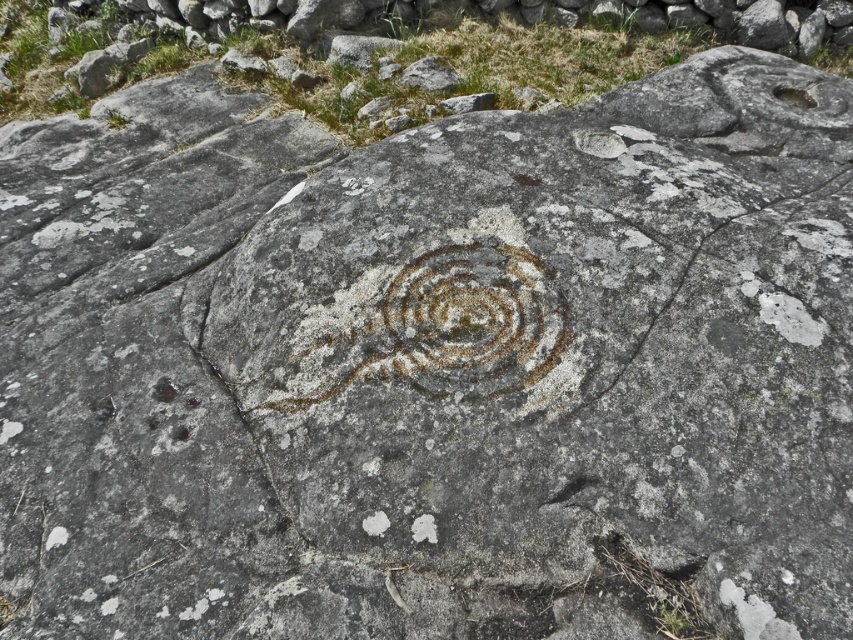
Can you confirm if gray rough crack at center is positioned to the right of rusty stone swirl at center?

Indeed, gray rough crack at center is positioned on the right side of rusty stone swirl at center.

Can you confirm if gray rough crack at center is positioned above rusty stone swirl at center?

Indeed, gray rough crack at center is positioned over rusty stone swirl at center.

The width and height of the screenshot is (853, 640). Identify the location of gray rough crack at center. (757, 316).

The image size is (853, 640). In order to click on gray rough crack at center in this screenshot , I will do `click(757, 316)`.